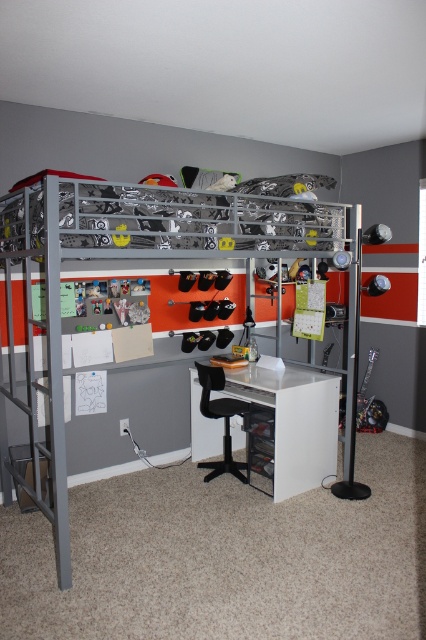
Is metallic silver bunk bed at upper center to the right of white glossy desk at center from the viewer's perspective?

In fact, metallic silver bunk bed at upper center is to the left of white glossy desk at center.

Is metallic silver bunk bed at upper center smaller than white glossy desk at center?

No, metallic silver bunk bed at upper center is not smaller than white glossy desk at center.

Identify the location of metallic silver bunk bed at upper center. (149, 259).

Between metallic silver bunk bed at upper center and black plastic stool at lower center, which one has less height?

With less height is black plastic stool at lower center.

Is point (270, 196) positioned after point (213, 416)?

No, it is in front of (213, 416).

Does point (77, 211) come behind point (233, 410)?

No, (77, 211) is in front of (233, 410).

The image size is (426, 640). I want to click on metallic silver bunk bed at upper center, so click(x=149, y=259).

Does white glossy desk at center come in front of black plastic stool at lower center?

Yes, it is in front of black plastic stool at lower center.

Can you confirm if white glossy desk at center is shorter than black plastic stool at lower center?

No, white glossy desk at center is not shorter than black plastic stool at lower center.

Is point (313, 428) in front of point (229, 467)?

Yes, it is in front of point (229, 467).

Where is `white glossy desk at center`? The height and width of the screenshot is (640, 426). white glossy desk at center is located at coordinates (285, 422).